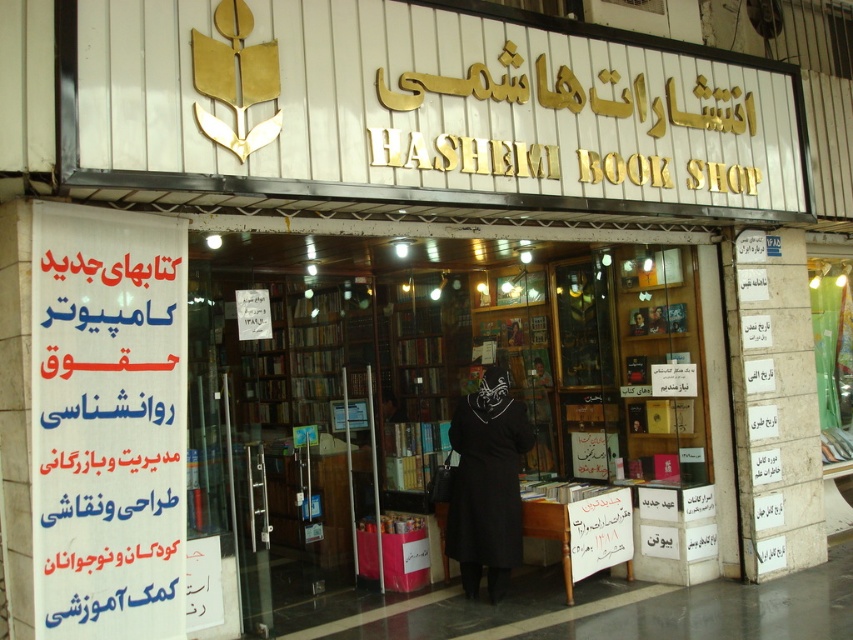
You are a customer entering the Hashemi Book Shop and see the white paper banner at left and the black matte dress at center. Which object is positioned higher relative to the other?

The white paper banner at left is above the black matte dress at center, so it is positioned higher.

You are a customer entering the Hashemi Book Shop and see the white paper banner at left and the black matte dress at center. Which object is positioned closer to the entrance from your perspective?

The white paper banner at left is closer to the entrance because it is positioned to the left of the black matte dress at center, which is further inward from the entrance.